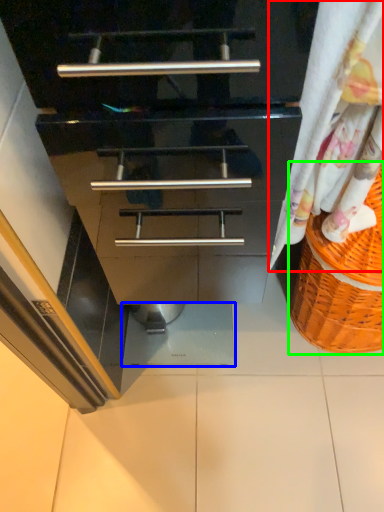
Question: Considering the real-world distances, which object is farthest from curtain (highlighted by a red box)? tile (highlighted by a blue box) or basket (highlighted by a green box)?

Choices:
 (A) tile
 (B) basket

Answer: (A)